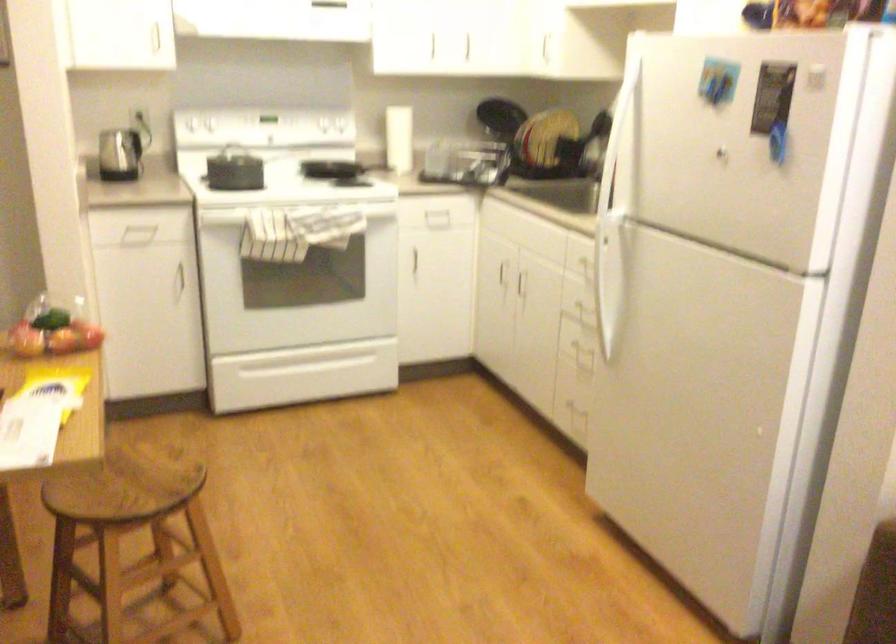
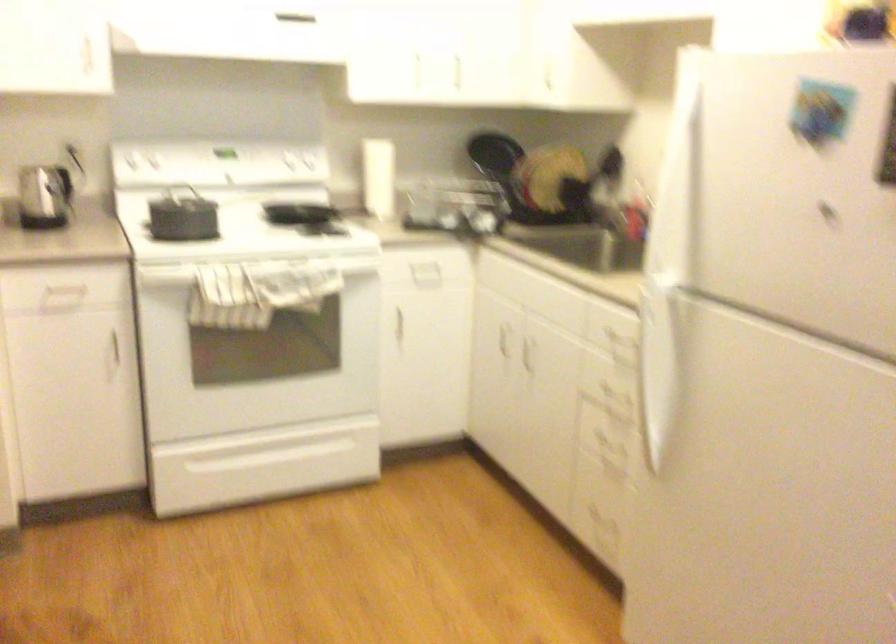
In the second image, find the point that corresponds to [316,361] in the first image.

(280, 446)